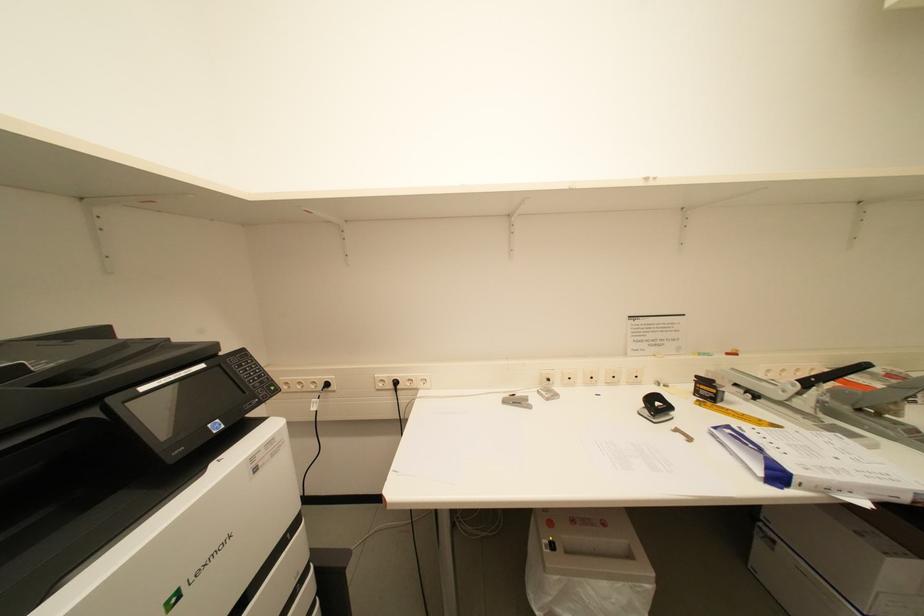
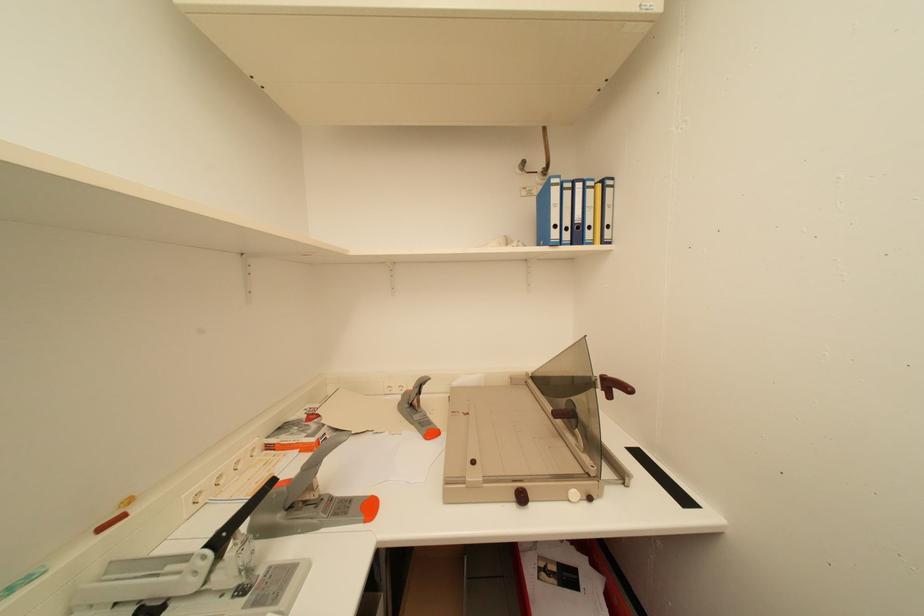
Question: Based on the continuous images, in which direction is the camera rotating? Reply with the corresponding letter.

Choices:
 (A) Left
 (B) Right
 (C) Up
 (D) Down

Answer: (B)